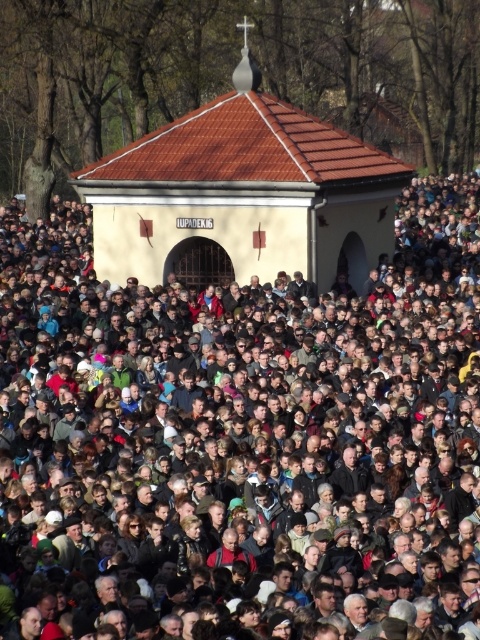
Question: Which object appears closest to the camera in this image?

Choices:
 (A) beige stucco chapel at center
 (B) brown textured building at center

Answer: (B)

Question: Which of the following is the closest to the observer?

Choices:
 (A) (202, 140)
 (B) (46, 308)

Answer: (B)

Question: Is brown textured building at center smaller than beige stucco chapel at center?

Choices:
 (A) yes
 (B) no

Answer: (B)

Question: Considering the relative positions of brown textured building at center and beige stucco chapel at center in the image provided, where is brown textured building at center located with respect to beige stucco chapel at center?

Choices:
 (A) above
 (B) below

Answer: (B)

Question: Where is brown textured building at center located in relation to beige stucco chapel at center in the image?

Choices:
 (A) below
 (B) above

Answer: (A)